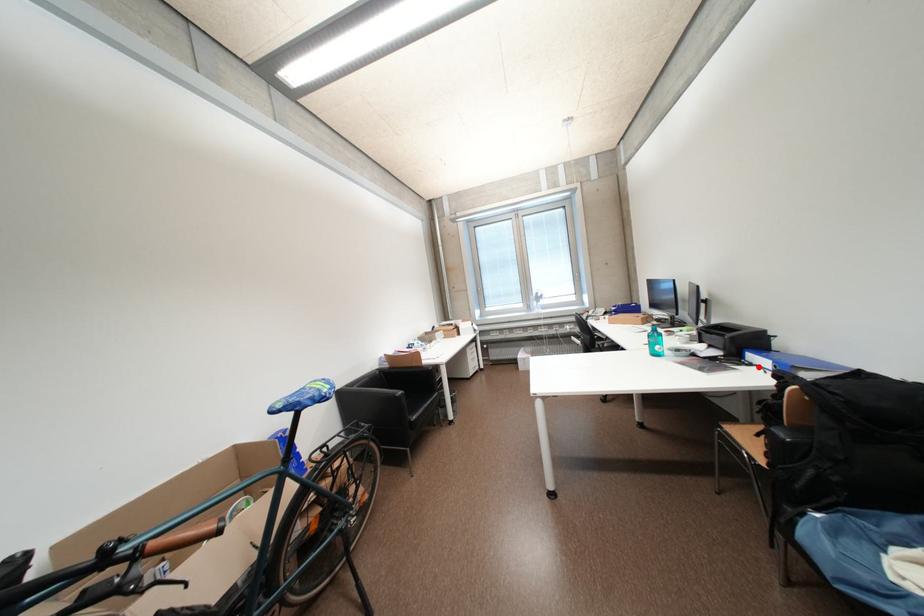
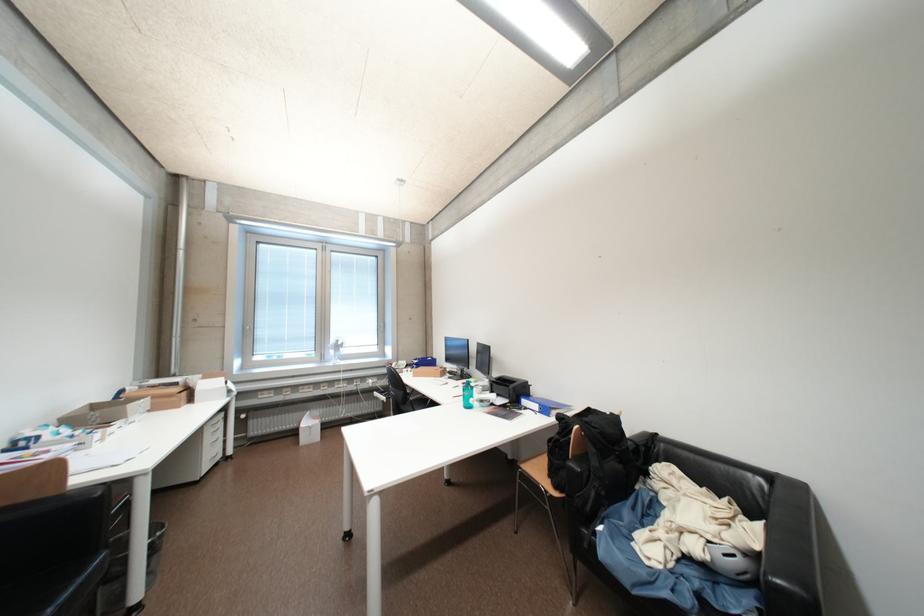
The point at the highlighted location is marked in the first image. Where is the corresponding point in the second image?

(533, 411)